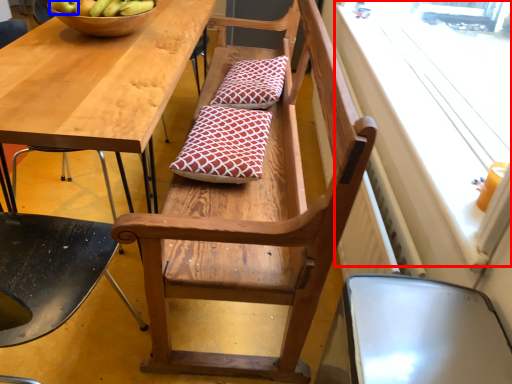
Question: Among these objects, which one is nearest to the camera, window screen (highlighted by a red box) or apple (highlighted by a blue box)?

Choices:
 (A) window screen
 (B) apple

Answer: (A)